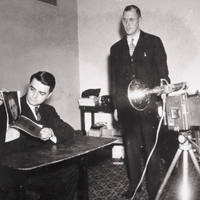
I want to click on wall, so click(x=75, y=33), click(x=92, y=33).